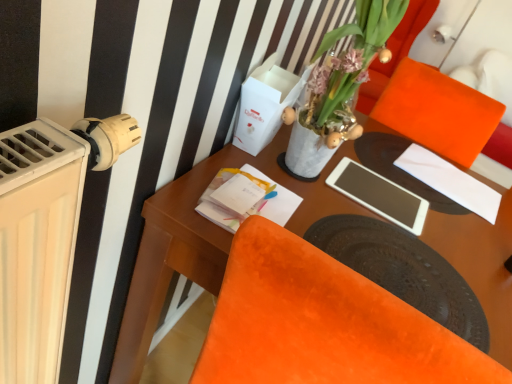
Question: Is velvet orange chair at lower right situated inside translucent glass vase at upper center or outside?

Choices:
 (A) inside
 (B) outside

Answer: (B)

Question: In terms of width, does velvet orange chair at lower right look wider or thinner when compared to translucent glass vase at upper center?

Choices:
 (A) thin
 (B) wide

Answer: (B)

Question: Estimate the real-world distances between objects in this image. Which object is farther from the orange velvet armchair at upper right?

Choices:
 (A) white matte tablet at center
 (B) velvet orange chair at lower right
 (C) wooden desk at center
 (D) translucent glass vase at upper center
 (E) white paper at upper right

Answer: (B)

Question: Which object is the farthest from the white paper at upper right?

Choices:
 (A) translucent glass vase at upper center
 (B) wooden desk at center
 (C) white matte tablet at center
 (D) velvet orange chair at lower right
 (E) orange velvet armchair at upper right

Answer: (D)